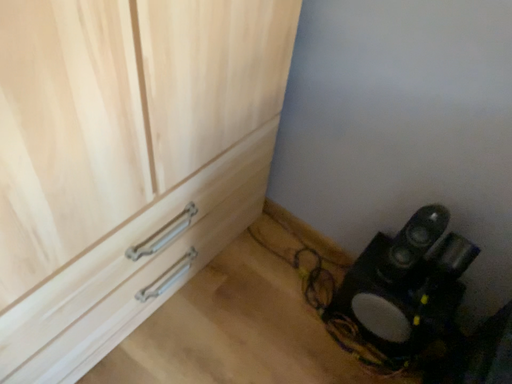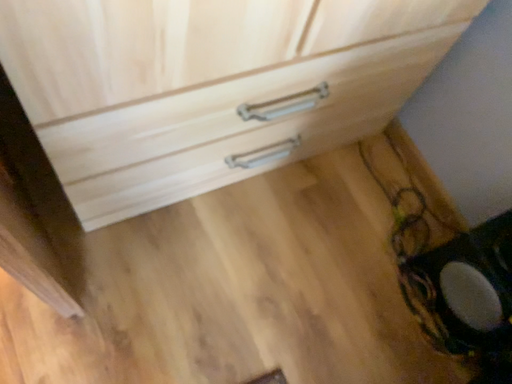
Question: How did the camera likely rotate when shooting the video?

Choices:
 (A) rotated right
 (B) rotated left

Answer: (B)